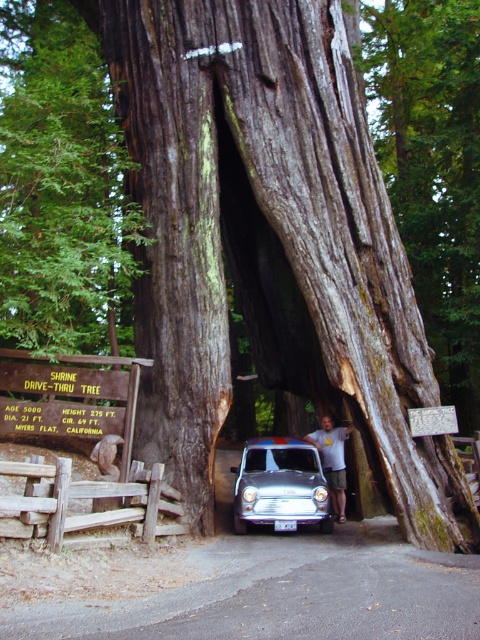
You are a photographer planning to take a picture of the shiny silver car at center. To ensure the car is well lit, you need to position yourself so that the sunlight hits the car directly. Based on the scene, where should you stand relative to the car?

The shiny silver car at center is located at point (x=279, y=484). Since the hollow section of the tree is dark inside and the bright daylight is outside, you should position yourself outside the hollow section facing the car to ensure sunlight hits it directly for better lighting.